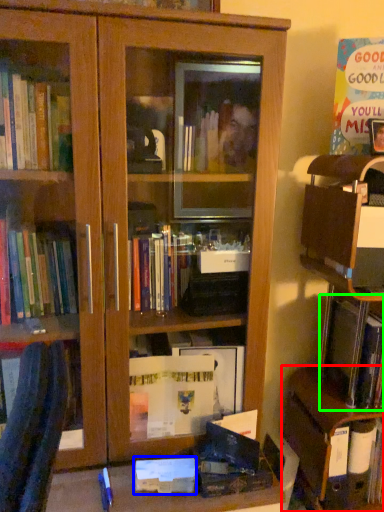
Question: Which is nearer to the cabinetry (highlighted by a red box)? paperback book (highlighted by a blue box) or book (highlighted by a green box).

Choices:
 (A) paperback book
 (B) book

Answer: (B)